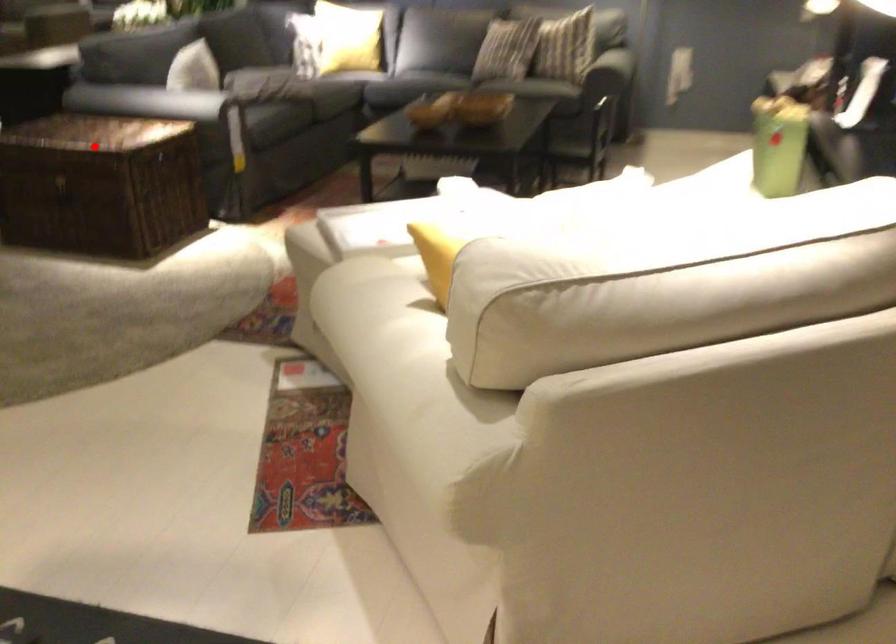
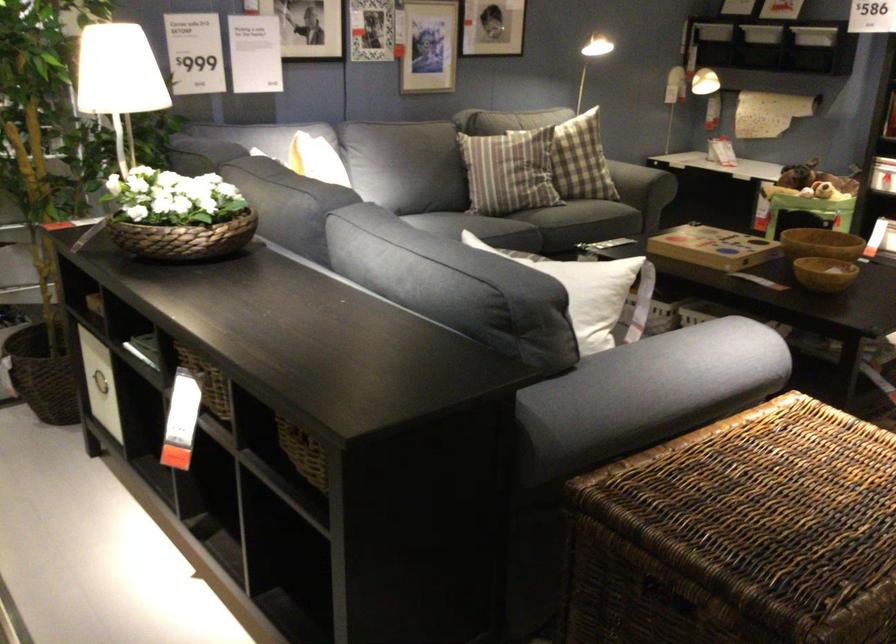
Question: I am providing you with two images of the same scene from different viewpoints. Given a red point in image1, look at the same physical point in image2. Is it:

Choices:
 (A) Closer to the viewpoint
 (B) Farther from the viewpoint

Answer: (A)